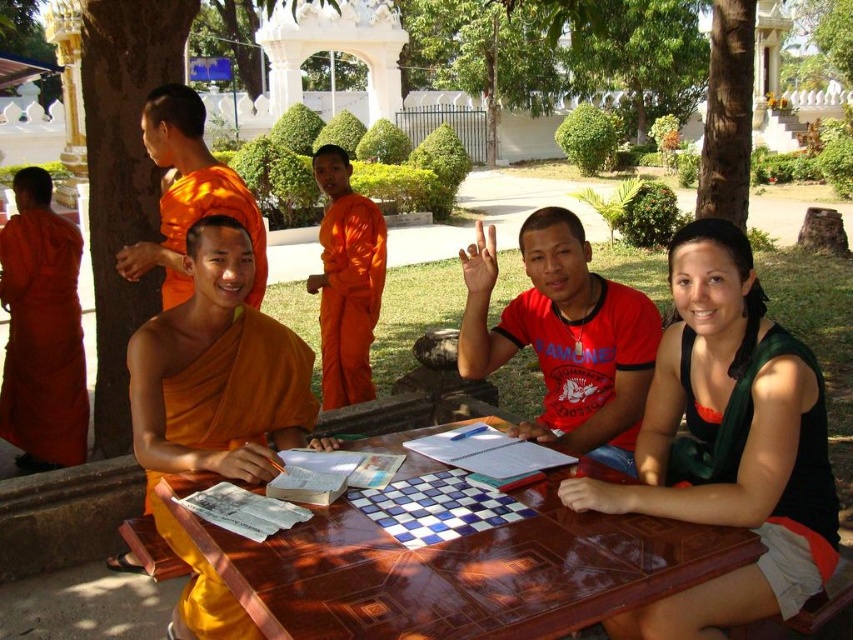
Question: Can you confirm if brown wooden table at center is positioned to the right of orange cloth robe at left?

Choices:
 (A) yes
 (B) no

Answer: (A)

Question: Which object is farther from the camera taking this photo?

Choices:
 (A) orange cloth robe at left
 (B) brown wooden table at center

Answer: (A)

Question: Among these points, which one is farthest from the camera?

Choices:
 (A) (819, 397)
 (B) (178, 216)

Answer: (B)

Question: Among these points, which one is farthest from the camera?

Choices:
 (A) (741, 620)
 (B) (831, 550)
 (C) (32, 257)

Answer: (C)

Question: Does orange cloth robe at left have a larger size compared to orange cloth at left?

Choices:
 (A) yes
 (B) no

Answer: (B)

Question: Is brown wooden table at center to the left of orange cloth monk at center from the viewer's perspective?

Choices:
 (A) yes
 (B) no

Answer: (A)